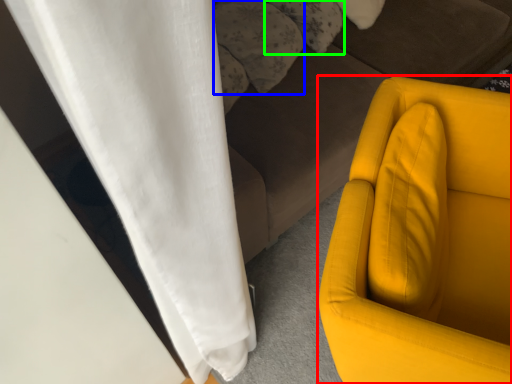
Question: Which object is positioned farthest from furniture (highlighted by a red box)? Select from pillow (highlighted by a blue box) and pillow (highlighted by a green box).

Choices:
 (A) pillow
 (B) pillow

Answer: (B)